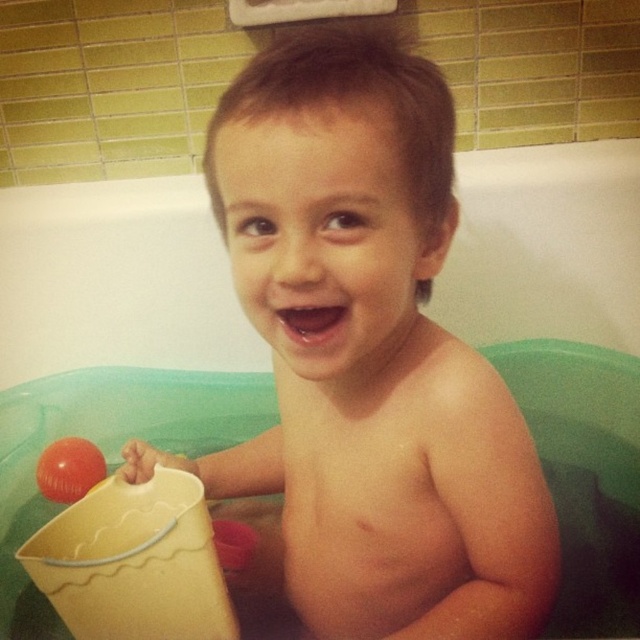
Which of these two, smooth skin child at center or rubber ball at left, stands taller?

Standing taller between the two is smooth skin child at center.

Who is shorter, smooth skin child at center or rubber ball at left?

rubber ball at left is shorter.

Between point (396, 84) and point (93, 448), which one is positioned behind?

The point (93, 448) is behind.

At what (x,y) coordinates should I click in order to perform the action: click on smooth skin child at center. Please return your answer as a coordinate pair (x, y). This screenshot has width=640, height=640. Looking at the image, I should click on (368, 355).